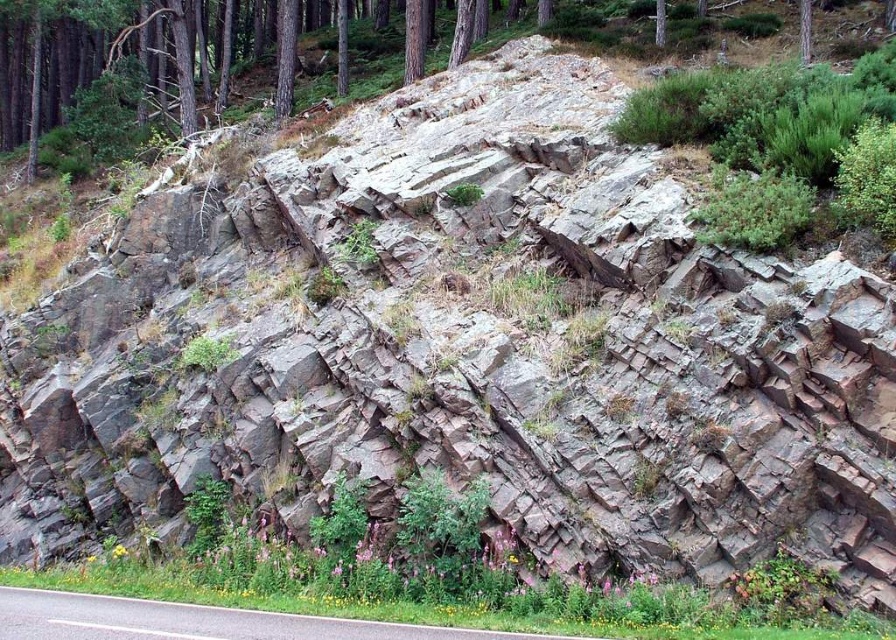
Does point (490, 636) come closer to viewer compared to point (800, 60)?

Yes, point (490, 636) is in front of point (800, 60).

Where is `asphalt road at lower left`? The image size is (896, 640). asphalt road at lower left is located at coordinates (201, 620).